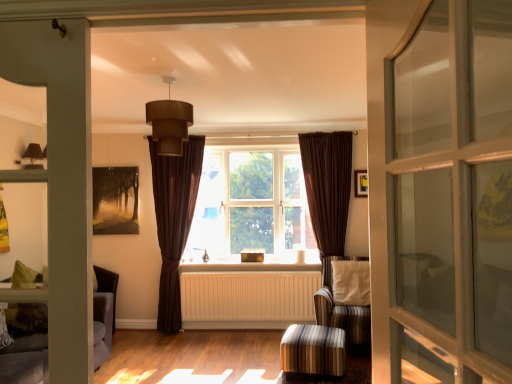
Question: Is the position of brown fabric curtain at center more distant than that of striped fabric armchair at center?

Choices:
 (A) no
 (B) yes

Answer: (B)

Question: From the image's perspective, is brown fabric curtain at center on top of striped fabric armchair at center?

Choices:
 (A) no
 (B) yes

Answer: (B)

Question: From the image's perspective, is brown fabric curtain at center beneath striped fabric armchair at center?

Choices:
 (A) yes
 (B) no

Answer: (B)

Question: Considering the relative sizes of brown fabric curtain at center and striped fabric armchair at center in the image provided, is brown fabric curtain at center taller than striped fabric armchair at center?

Choices:
 (A) no
 (B) yes

Answer: (B)

Question: Can you confirm if brown fabric curtain at center is bigger than striped fabric armchair at center?

Choices:
 (A) no
 (B) yes

Answer: (B)

Question: Is point (359, 180) closer or farther from the camera than point (212, 324)?

Choices:
 (A) farther
 (B) closer

Answer: (B)

Question: Is wooden picture frame at upper center to the left or to the right of white matte radiator at center in the image?

Choices:
 (A) right
 (B) left

Answer: (A)

Question: In terms of width, does wooden picture frame at upper center look wider or thinner when compared to white matte radiator at center?

Choices:
 (A) thin
 (B) wide

Answer: (A)

Question: From the image's perspective, is wooden picture frame at upper center positioned above or below white matte radiator at center?

Choices:
 (A) above
 (B) below

Answer: (A)

Question: From their relative heights in the image, would you say brown velvet curtain at center, positioned as the first curtain in left-to-right order, is taller or shorter than white matte radiator at center?

Choices:
 (A) tall
 (B) short

Answer: (A)

Question: From the image's perspective, is brown velvet curtain at center, positioned as the first curtain in left-to-right order, above or below white matte radiator at center?

Choices:
 (A) above
 (B) below

Answer: (A)

Question: Looking at the image, does brown velvet curtain at center, the second curtain positioned from the right, seem bigger or smaller compared to white matte radiator at center?

Choices:
 (A) small
 (B) big

Answer: (B)

Question: Is point (175, 173) positioned closer to the camera than point (256, 299)?

Choices:
 (A) farther
 (B) closer

Answer: (B)

Question: Is point (331, 148) positioned closer to the camera than point (406, 304)?

Choices:
 (A) closer
 (B) farther

Answer: (B)

Question: Based on their positions, is brown velvet curtain at center, marked as the second curtain in a left-to-right arrangement, located to the left or right of clear glass screen door at right?

Choices:
 (A) left
 (B) right

Answer: (B)